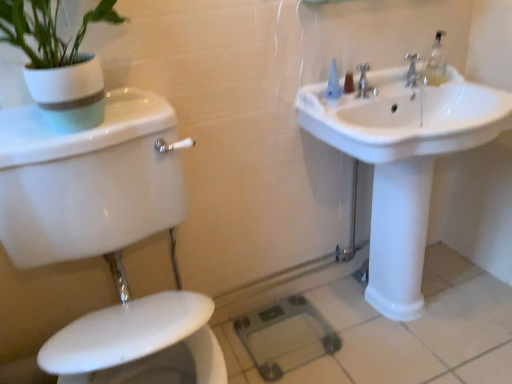
What is the approximate height of white glossy toilet at lower left?

The height of white glossy toilet at lower left is 37.06 inches.

Where is `white glossy toilet at lower left`? white glossy toilet at lower left is located at coordinates (106, 237).

Identify the location of metallic silver faucet at upper right, which is counted as the 1th tap, starting from the right. Image resolution: width=512 pixels, height=384 pixels. (412, 69).

Is white glossy toilet at lower left oriented towards white glossy sink at upper right?

No, white glossy toilet at lower left does not turn towards white glossy sink at upper right.

Would you say white glossy sink at upper right is part of white glossy toilet at lower left's contents?

Definitely not — white glossy sink at upper right is not inside white glossy toilet at lower left.

From a real-world perspective, relative to white glossy sink at upper right, is white glossy toilet at lower left vertically above or below?

white glossy toilet at lower left is situated higher than white glossy sink at upper right in the real world.

Between point (20, 265) and point (349, 125), which one is positioned in front?

The point (20, 265) is closer to the camera.

Does point (370, 89) come closer to viewer compared to point (416, 77)?

That is True.

From a real-world perspective, who is located higher, silver metallic faucet at upper center, which appears as the 2th tap when viewed from the right, or metallic silver faucet at upper right, which is counted as the 1th tap, starting from the right?

From a 3D spatial view, silver metallic faucet at upper center, which appears as the 2th tap when viewed from the right, is above.

Is silver metallic faucet at upper center, the first tap in the left-to-right sequence, facing towards metallic silver faucet at upper right, which is counted as the 1th tap, starting from the right?

No, silver metallic faucet at upper center, the first tap in the left-to-right sequence, is not facing towards metallic silver faucet at upper right, which is counted as the 1th tap, starting from the right.

Does silver metallic faucet at upper center, which appears as the 2th tap when viewed from the right, contain white glossy toilet at lower left?

No.

From a real-world perspective, is silver metallic faucet at upper center, which appears as the 2th tap when viewed from the right, positioned under white glossy toilet at lower left based on gravity?

No.

Does silver metallic faucet at upper center, the first tap in the left-to-right sequence, come behind white glossy toilet at lower left?

Yes, silver metallic faucet at upper center, the first tap in the left-to-right sequence, is further from the viewer.

Can you see silver metallic faucet at upper center, which appears as the 2th tap when viewed from the right, touching white glossy toilet at lower left?

No, silver metallic faucet at upper center, which appears as the 2th tap when viewed from the right, is not making contact with white glossy toilet at lower left.

Is there a large distance between white glossy sink at upper right and white glossy toilet at lower left?

No, white glossy sink at upper right is in close proximity to white glossy toilet at lower left.

How many degrees apart are the facing directions of white glossy sink at upper right and white glossy toilet at lower left?

The angular difference between white glossy sink at upper right and white glossy toilet at lower left is 1.18 degrees.

Looking at their sizes, would you say white glossy sink at upper right is wider or thinner than white glossy toilet at lower left?

Clearly, white glossy sink at upper right has less width compared to white glossy toilet at lower left.

Considering the positions of objects white glossy sink at upper right and white glossy toilet at lower left in the image provided, who is more to the left, white glossy sink at upper right or white glossy toilet at lower left?

white glossy toilet at lower left is more to the left.

Considering the positions of objects white glossy sink at upper right and silver metallic faucet at upper center, the first tap in the left-to-right sequence, in the image provided, who is more to the right, white glossy sink at upper right or silver metallic faucet at upper center, the first tap in the left-to-right sequence,?

white glossy sink at upper right.

From the picture: In the image, is white glossy sink at upper right positioned in front of or behind silver metallic faucet at upper center, the first tap in the left-to-right sequence?

Visually, white glossy sink at upper right is located in front of silver metallic faucet at upper center, the first tap in the left-to-right sequence.

Which of these two, white glossy sink at upper right or silver metallic faucet at upper center, which appears as the 2th tap when viewed from the right, is wider?

white glossy sink at upper right.

From a real-world perspective, which is physically below, white glossy sink at upper right or silver metallic faucet at upper center, which appears as the 2th tap when viewed from the right?

In real-world perspective, white glossy sink at upper right is lower.

Can you confirm if silver metallic faucet at upper center, the first tap in the left-to-right sequence, is shorter than white glossy pot at upper left?

Correct, silver metallic faucet at upper center, the first tap in the left-to-right sequence, is not as tall as white glossy pot at upper left.

Which object is further away from the camera taking this photo, silver metallic faucet at upper center, which appears as the 2th tap when viewed from the right, or white glossy pot at upper left?

silver metallic faucet at upper center, which appears as the 2th tap when viewed from the right, is further from the camera.

From the image's perspective, which object appears higher, silver metallic faucet at upper center, which appears as the 2th tap when viewed from the right, or white glossy pot at upper left?

silver metallic faucet at upper center, which appears as the 2th tap when viewed from the right, from the image's perspective.

Between silver metallic faucet at upper center, which appears as the 2th tap when viewed from the right, and white glossy pot at upper left, which one appears on the left side from the viewer's perspective?

From the viewer's perspective, white glossy pot at upper left appears more on the left side.

Is white glossy pot at upper left touching white glossy toilet at lower left?

No.

Considering the sizes of white glossy pot at upper left and white glossy toilet at lower left in the image, is white glossy pot at upper left taller or shorter than white glossy toilet at lower left?

In the image, white glossy pot at upper left appears to be shorter than white glossy toilet at lower left.

Between white glossy pot at upper left and white glossy toilet at lower left, which one is positioned in front?

Positioned in front is white glossy toilet at lower left.

Considering the positions of point (37, 66) and point (156, 333), is point (37, 66) closer or farther from the camera than point (156, 333)?

Point (37, 66) appears to be farther away from the viewer than point (156, 333).

You are a GUI agent. You are given a task and a screenshot of the screen. Output one action in this format:
    pyautogui.click(x=<x>, y=<y>)
    Task: Click on the sink behind the white glossy toilet at lower left
    
    Given the screenshot: What is the action you would take?
    (x=403, y=163)

Find the location of `tap located below the metallic silver faucet at upper right, which is counted as the 1th tap, starting from the right (from the image's perspective)`. tap located below the metallic silver faucet at upper right, which is counted as the 1th tap, starting from the right (from the image's perspective) is located at coordinates (364, 82).

Which object lies further to the anchor point white glossy toilet at lower left, metallic silver faucet at upper right, the second tap in the left-to-right sequence, or silver metallic faucet at upper center, which appears as the 2th tap when viewed from the right?

metallic silver faucet at upper right, the second tap in the left-to-right sequence, is further to white glossy toilet at lower left.

Looking at the image, which one is located closer to white glossy pot at upper left, silver metallic faucet at upper center, which appears as the 2th tap when viewed from the right, or white glossy sink at upper right?

Among the two, white glossy sink at upper right is located nearer to white glossy pot at upper left.

From the image, which object appears to be nearer to white glossy pot at upper left, metallic silver faucet at upper right, which is counted as the 1th tap, starting from the right, or silver metallic faucet at upper center, which appears as the 2th tap when viewed from the right?

silver metallic faucet at upper center, which appears as the 2th tap when viewed from the right, lies closer to white glossy pot at upper left than the other object.

Looking at the image, which one is located further to white glossy sink at upper right, white glossy toilet at lower left or silver metallic faucet at upper center, which appears as the 2th tap when viewed from the right?

white glossy toilet at lower left is further to white glossy sink at upper right.

When comparing their distances from white glossy pot at upper left, does silver metallic faucet at upper center, the first tap in the left-to-right sequence, or white glossy toilet at lower left seem closer?

white glossy toilet at lower left.

When comparing their distances from white glossy toilet at lower left, does white glossy sink at upper right or silver metallic faucet at upper center, which appears as the 2th tap when viewed from the right, seem further?

The object further to white glossy toilet at lower left is silver metallic faucet at upper center, which appears as the 2th tap when viewed from the right.

When comparing their distances from white glossy toilet at lower left, does white glossy pot at upper left or silver metallic faucet at upper center, the first tap in the left-to-right sequence, seem further?

silver metallic faucet at upper center, the first tap in the left-to-right sequence, is positioned further to the anchor white glossy toilet at lower left.

Looking at the image, which one is located further to white glossy sink at upper right, white glossy toilet at lower left or white glossy pot at upper left?

white glossy pot at upper left lies further to white glossy sink at upper right than the other object.

Identify the location of sink between white glossy toilet at lower left and silver metallic faucet at upper center, the first tap in the left-to-right sequence, in the front-back direction. The width and height of the screenshot is (512, 384). click(x=403, y=163).

Where is `houseplant between white glossy toilet at lower left and silver metallic faucet at upper center, which appears as the 2th tap when viewed from the right, in the front-back direction`? The height and width of the screenshot is (384, 512). houseplant between white glossy toilet at lower left and silver metallic faucet at upper center, which appears as the 2th tap when viewed from the right, in the front-back direction is located at coordinates (59, 63).

The width and height of the screenshot is (512, 384). I want to click on toilet between white glossy pot at upper left and metallic silver faucet at upper right, the second tap in the left-to-right sequence, so click(x=106, y=237).

The image size is (512, 384). Find the location of `toilet between white glossy pot at upper left and white glossy sink at upper right in the horizontal direction`. toilet between white glossy pot at upper left and white glossy sink at upper right in the horizontal direction is located at coordinates (106, 237).